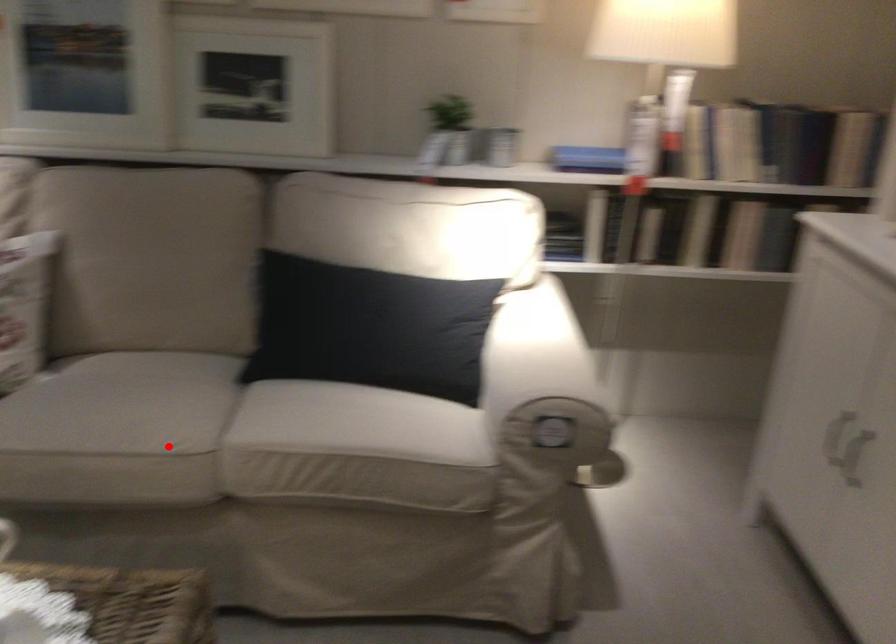
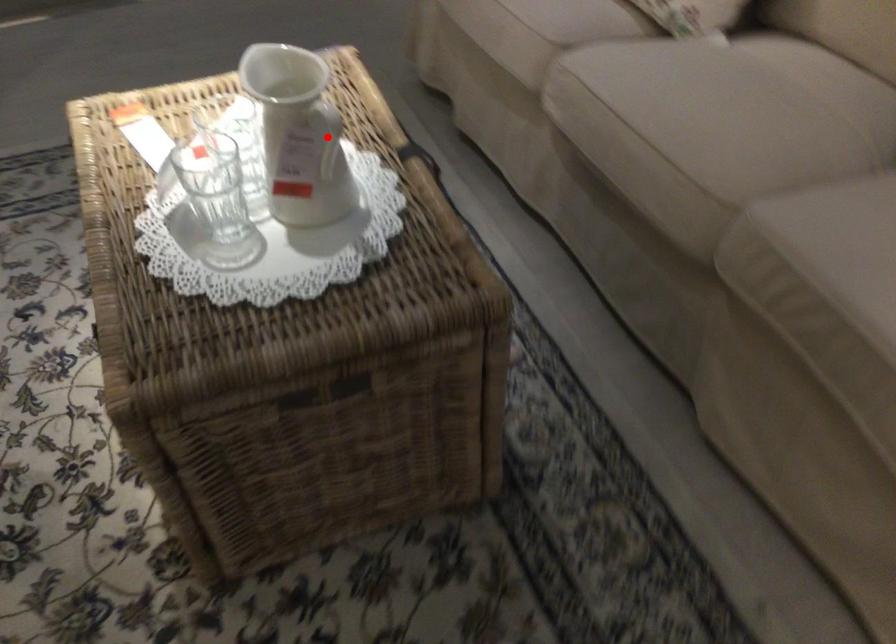
I am providing you with two images of the same scene from different viewpoints. A red point is marked on the first image and another point is marked on the second image. Are the points marked in image1 and image2 representing the same 3D position?

No